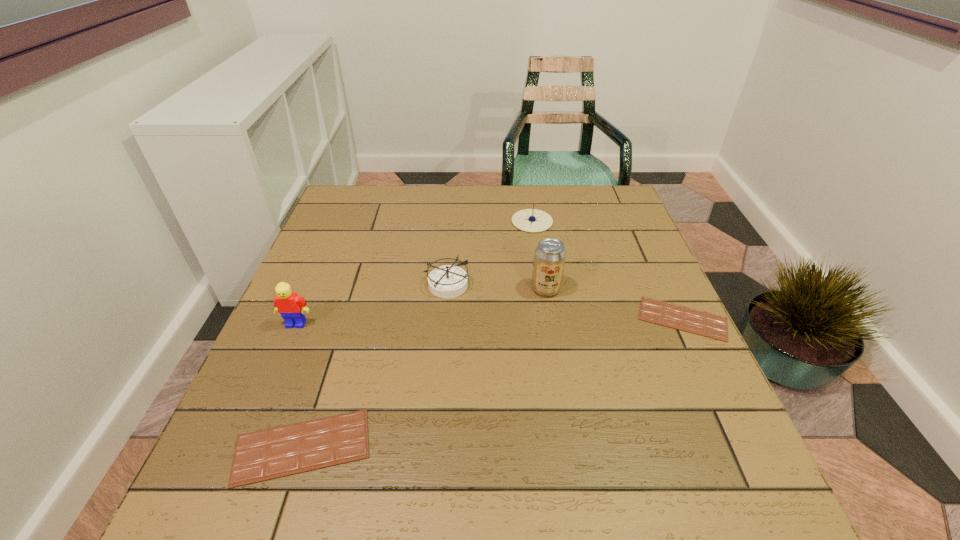
Image resolution: width=960 pixels, height=540 pixels. I want to click on free space between the beer can and the nearer compass, so click(x=496, y=287).

Locate an element on the screen. Image resolution: width=960 pixels, height=540 pixels. empty space that is in between the beer can and the rightmost object is located at coordinates (614, 303).

Where is `free space between the right compass and the left chocolate bar`? The width and height of the screenshot is (960, 540). free space between the right compass and the left chocolate bar is located at coordinates (418, 334).

This screenshot has width=960, height=540. What are the coordinates of `empty space between the farther compass and the Lego` in the screenshot? It's located at (414, 273).

Find the location of a particular element. The height and width of the screenshot is (540, 960). vacant space that's between the farther compass and the taller chocolate bar is located at coordinates (418, 334).

This screenshot has height=540, width=960. I want to click on free point between the beer can and the Lego, so click(421, 306).

The image size is (960, 540). I want to click on free spot between the Lego and the beer can, so click(x=421, y=306).

Image resolution: width=960 pixels, height=540 pixels. I want to click on vacant space that's between the Lego and the farthest object, so click(x=414, y=273).

The width and height of the screenshot is (960, 540). I want to click on free area in between the beer can and the left compass, so [496, 287].

Find the location of a particular element. The width and height of the screenshot is (960, 540). object that can be found as the third closest to the shortest object is located at coordinates (448, 281).